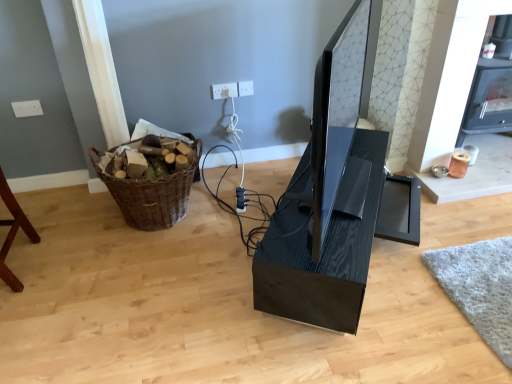
Question: Is matte black monitor at center turned away from black glossy computer desk at center?

Choices:
 (A) no
 (B) yes

Answer: (A)

Question: Considering the relative sizes of matte black monitor at center and black glossy computer desk at center in the image provided, is matte black monitor at center smaller than black glossy computer desk at center?

Choices:
 (A) no
 (B) yes

Answer: (B)

Question: Considering the relative sizes of matte black monitor at center and black glossy computer desk at center in the image provided, is matte black monitor at center wider than black glossy computer desk at center?

Choices:
 (A) no
 (B) yes

Answer: (A)

Question: Would you say matte black monitor at center is outside black glossy computer desk at center?

Choices:
 (A) no
 (B) yes

Answer: (B)

Question: From a real-world perspective, is matte black monitor at center under black glossy computer desk at center?

Choices:
 (A) yes
 (B) no

Answer: (B)

Question: Could you tell me if matte black monitor at center is turned towards black glossy computer desk at center?

Choices:
 (A) yes
 (B) no

Answer: (B)

Question: Can we say white plastic electric outlet at upper center, the 2th electric outlet when ordered from right to left, lies outside black plastic plug at center?

Choices:
 (A) yes
 (B) no

Answer: (A)

Question: Is white plastic electric outlet at upper center, the 2th electric outlet when ordered from right to left, smaller than black plastic plug at center?

Choices:
 (A) no
 (B) yes

Answer: (B)

Question: Is white plastic electric outlet at upper center, the 2th electric outlet when ordered from right to left, looking in the opposite direction of black plastic plug at center?

Choices:
 (A) no
 (B) yes

Answer: (A)

Question: Can you confirm if white plastic electric outlet at upper center, the 2th electric outlet when ordered from right to left, is positioned to the right of black plastic plug at center?

Choices:
 (A) no
 (B) yes

Answer: (A)

Question: Considering the relative sizes of white plastic electric outlet at upper center, the 1th electric outlet viewed from the left, and black plastic plug at center in the image provided, is white plastic electric outlet at upper center, the 1th electric outlet viewed from the left, wider than black plastic plug at center?

Choices:
 (A) yes
 (B) no

Answer: (B)

Question: Is white plastic electric outlet at upper center, the 2th electric outlet when ordered from right to left, not near black plastic plug at center?

Choices:
 (A) no
 (B) yes

Answer: (A)

Question: Is white plastic electric outlet at upper center, which appears as the 1th electric outlet when viewed from the right, far away from black plastic plug at center?

Choices:
 (A) yes
 (B) no

Answer: (B)